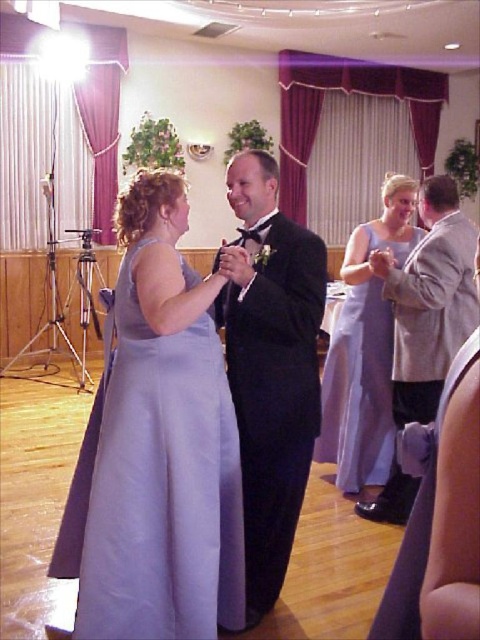
You are standing at the entrance of the banquet hall and notice two points marked on the floor. The first point is labeled as point (187, 532) and the second is point (375, 365). If you want to move towards the dance floor, which point should you aim for first?

Point (187, 532) is in front of point (375, 365), so you should aim for point (187, 532) first as it is closer to your current position at the entrance.

You are a photographer holding a camera. You want to take a photo of the lavender satin dress at center from a distance that allows you to capture the entire dress without cropping it. The dress is 1.89 meters away from your camera. According to photography guidelines, to capture a full body shot without distortion, the minimum recommended distance is 1.5 times the height of the subject. Assuming the dress stands at the same height as an average adult woman, approximately 165 cm tall, is the current camera

The lavender satin dress at center is 1.89 meters away from the camera. Since the recommended distance is 1.5 times the subject height, which would be 1.5 x 1.65meters equals 2.475 meters. The current distance of 1.89 meters is less than the recommended 2.475 meters, so the photographer is too close to capture the entire dress without distortion. They need to move back approximately 0.58 meters further.

You are a photographer at the event and need to frame both the lavender satin dress at center and the lavender satin dress at right in a single shot. Considering their sizes, which dress should you focus on to ensure both fit comfortably in the frame?

The lavender satin dress at center is wider than the lavender satin dress at right, so focusing on the lavender satin dress at center will ensure both fit comfortably in the frame.